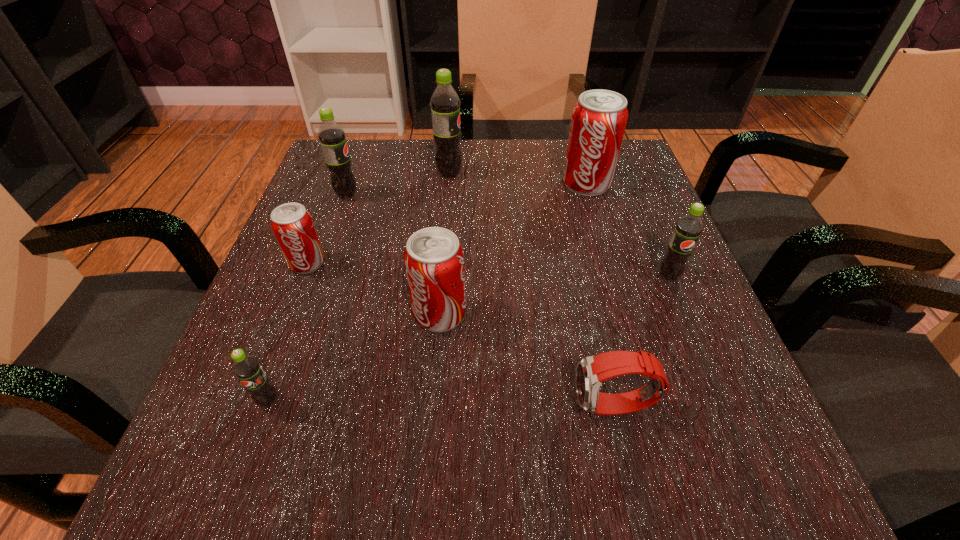
Identify the location of vacant region at the right edge of the desktop. (638, 376).

You are a GUI agent. You are given a task and a screenshot of the screen. Output one action in this format:
    pyautogui.click(x=<x>, y=<y>)
    Task: Click on the free space at the far left corner
    
    Given the screenshot: What is the action you would take?
    pyautogui.click(x=373, y=151)

In order to click on free location at the near left corner of the desktop in this screenshot , I will do `click(257, 485)`.

Locate an element on the screen. Image resolution: width=960 pixels, height=540 pixels. vacant space at the far right corner of the desktop is located at coordinates (622, 164).

In the image, there is a desktop. Identify the location of blank space at the near right corner. The height and width of the screenshot is (540, 960). (748, 460).

Find the location of a particular element. Image resolution: width=960 pixels, height=540 pixels. empty space between the farthest red soda can and the rightmost object is located at coordinates (628, 230).

The image size is (960, 540). Identify the location of empty space that is in between the rightmost green soda and the red watch. (641, 341).

Identify the location of vacant area between the biggest red soda can and the watch. (600, 295).

Identify the location of vacant area that lies between the farthest red soda can and the second nearest soda. This screenshot has width=960, height=540. (513, 248).

Find the location of `free spot between the red watch and the second biggest green soda`. free spot between the red watch and the second biggest green soda is located at coordinates (481, 301).